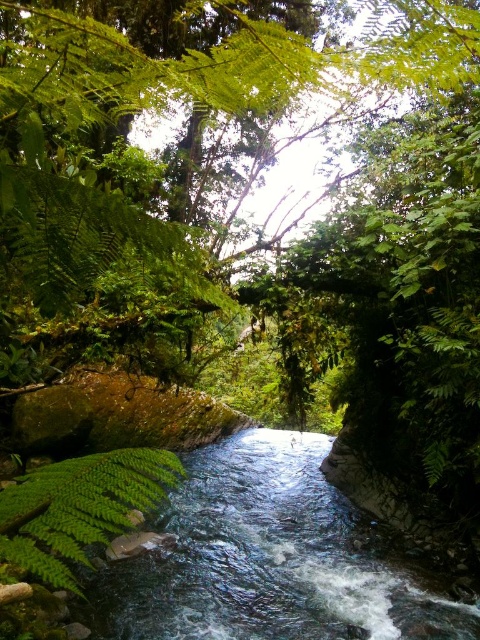
You are a hiker who wants to cross the clear water stream at center. The point you are standing at is at coordinate point (269,557). Is the stream at that point safe to cross?

The clear water stream at center is represented by point (269,557). Since the stream is fast moving and the point is in the center, it might be deeper and more forceful there, so crossing at that point could be dangerous. It is safer to look for a shallower area closer to the banks.

You are a hiker who wants to cross the stream safely. You see the clear water stream at center and the green leafy fern at center. Which direction should you walk to reach the stream from the fern?

You should walk to the right to reach the clear water stream at center from the green leafy fern at center because the stream is positioned to the right of the fern.

You are a hiker carrying a 1.5 meter wide tent. You come across the clear water stream at center and the green leafy fern at center. Can you set up your tent between them without the tent overlapping either object?

The clear water stream at center might be wider than green leafy fern at center. Since the stream could be wider than the fern, the tent might not fit between them if the space between the two objects is narrower than 1.5 meters. However, without exact measurements, it is uncertain whether the tent will fit without overlapping either object.